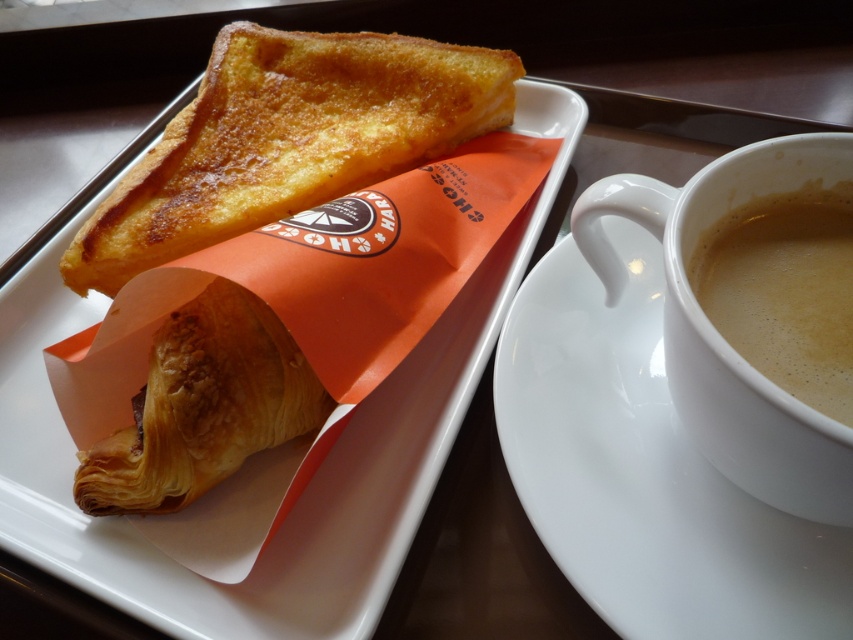
Question: Does white ceramic saucer at right appear on the right side of golden brown flaky croissant at upper left?

Choices:
 (A) no
 (B) yes

Answer: (B)

Question: Is matte white plate at upper left above white ceramic saucer at right?

Choices:
 (A) yes
 (B) no

Answer: (A)

Question: Which of the following is the closest to the observer?

Choices:
 (A) matte white plate at upper left
 (B) golden brown flaky croissant at upper left
 (C) brown frothy coffee at right
 (D) golden brown flaky croissant at lower left

Answer: (C)

Question: Does matte white plate at upper left appear over golden brown flaky croissant at upper left?

Choices:
 (A) yes
 (B) no

Answer: (B)

Question: Which is nearer to the white ceramic saucer at right?

Choices:
 (A) brown frothy coffee at right
 (B) matte white plate at upper left
 (C) golden brown flaky croissant at lower left

Answer: (A)

Question: Based on their relative distances, which object is nearer to the golden brown flaky croissant at upper left?

Choices:
 (A) golden brown flaky croissant at lower left
 (B) white ceramic saucer at right
 (C) matte white plate at upper left
 (D) brown frothy coffee at right

Answer: (C)